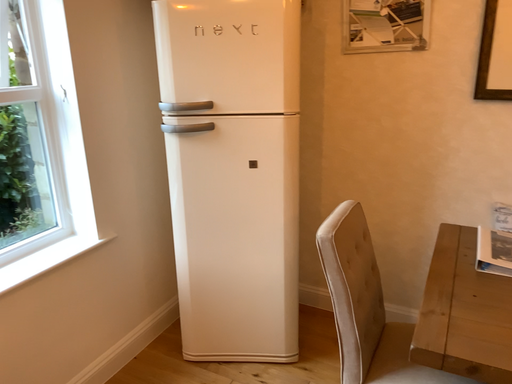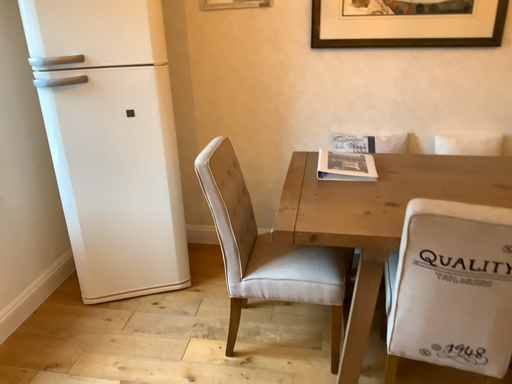
Question: How did the camera likely rotate when shooting the video?

Choices:
 (A) rotated left
 (B) rotated right

Answer: (B)